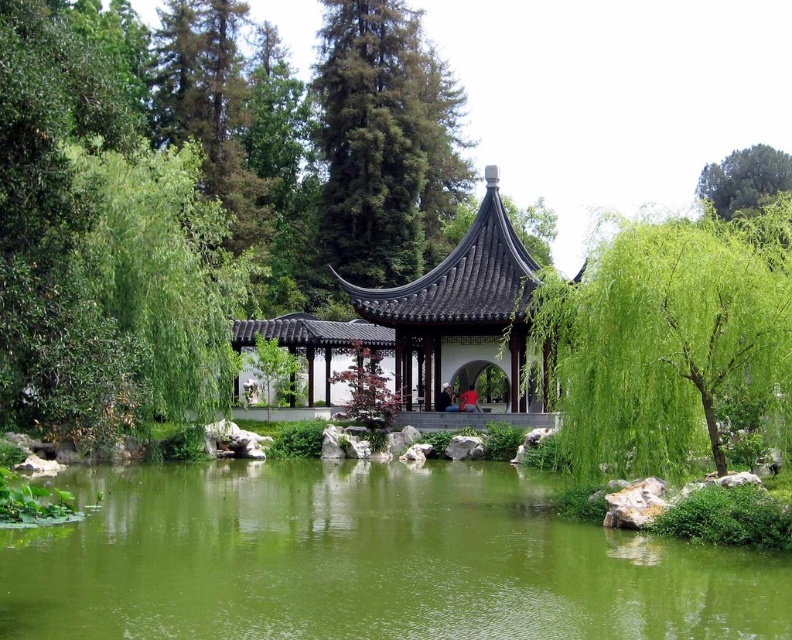
Question: Is green leafy tree at center to the left of green leafy tree at upper right from the viewer's perspective?

Choices:
 (A) no
 (B) yes

Answer: (B)

Question: Does black matte gazebo at center appear over green leafy tree at upper right?

Choices:
 (A) no
 (B) yes

Answer: (A)

Question: Among these points, which one is nearest to the camera?

Choices:
 (A) (371, 150)
 (B) (786, 186)
 (C) (436, 403)
 (D) (145, 563)

Answer: (D)

Question: Can you confirm if green liquid water at center is positioned to the right of green leafy tree at upper right?

Choices:
 (A) no
 (B) yes

Answer: (A)

Question: Which point is closer to the camera?

Choices:
 (A) (790, 188)
 (B) (67, 486)
 (C) (562, 285)

Answer: (C)

Question: Which point is closer to the camera?

Choices:
 (A) red fabric person at center
 (B) green liquid water at center

Answer: (B)